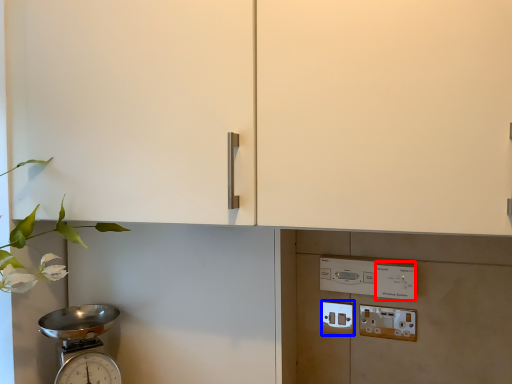
Question: Which object is further to the camera taking this photo, light switch (highlighted by a red box) or electric outlet (highlighted by a blue box)?

Choices:
 (A) light switch
 (B) electric outlet

Answer: (B)